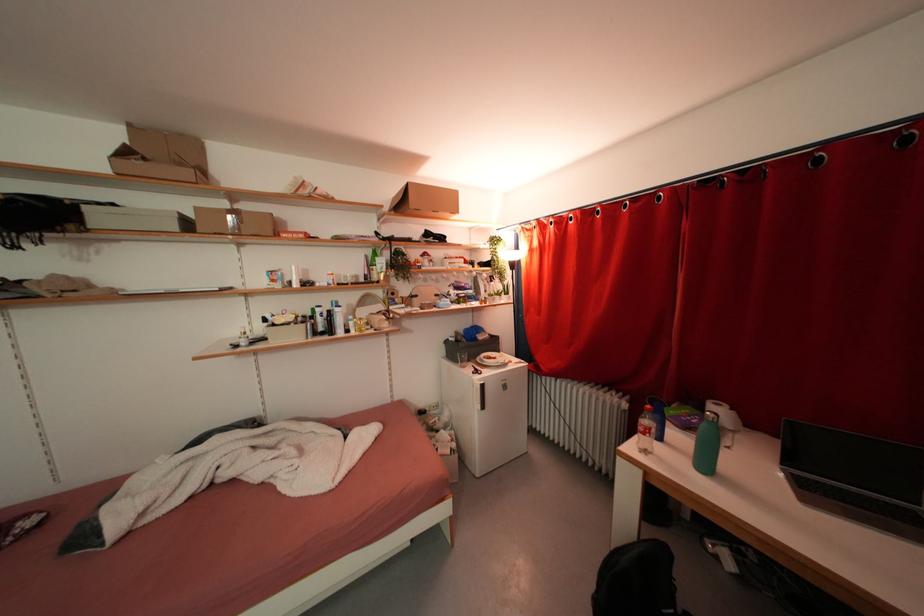
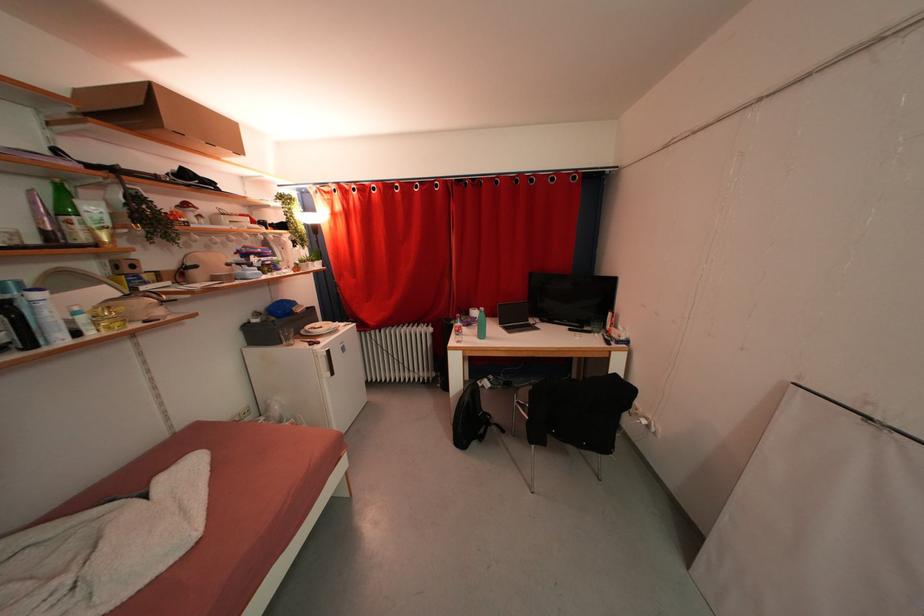
Find the pixel in the second image that matches (x=391, y=329) in the first image.

(165, 315)